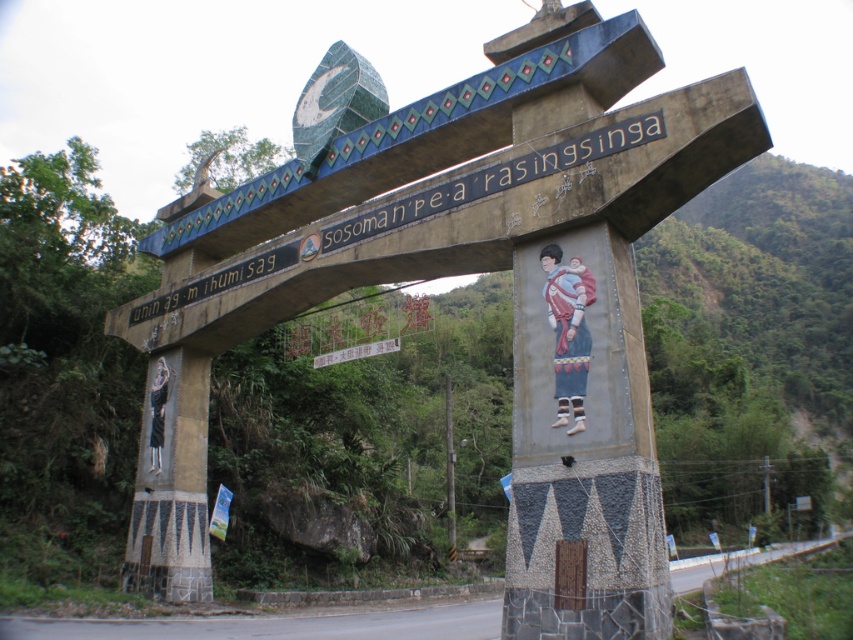
You are standing in front of the archway and want to locate the carved stone sign at center. According to the coordinates, where should you look relative to the archway?

The carved stone sign at center is located at coordinates point (496, 179), which is on the lower left side of the archway.

You are a delivery driver who needs to park your truck between the carved stone sign at center and the metallic pole at center. The truck is 20 feet long. Can you park your truck in that space without overlapping either object?

The distance between the carved stone sign at center and the metallic pole at center is 173.66 feet. Since the truck is only 20 feet long, there is more than enough space to park between them without overlapping either object.